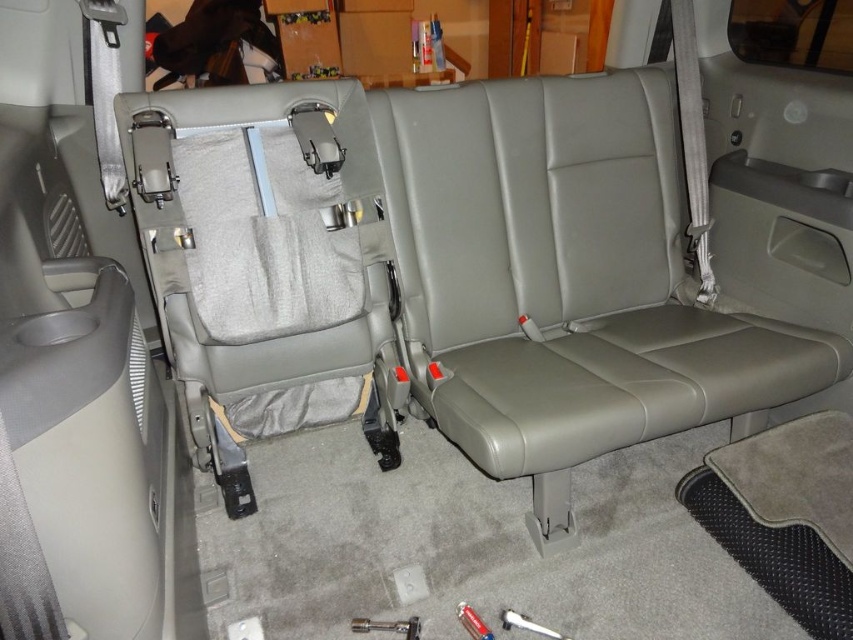
Is white plastic screwdriver at lower center thinner than metallic silver screwdriver at center?

No.

Who is positioned more to the left, white plastic screwdriver at lower center or metallic silver screwdriver at center?

From the viewer's perspective, metallic silver screwdriver at center appears more on the left side.

Between point (503, 612) and point (467, 625), which one is positioned behind?

Point (503, 612)

Find the location of a particular element. This screenshot has height=640, width=853. white plastic screwdriver at lower center is located at coordinates (527, 625).

Which is more to the right, metallic silver wrench at center or white plastic screwdriver at lower center?

white plastic screwdriver at lower center is more to the right.

Which is below, metallic silver wrench at center or white plastic screwdriver at lower center?

metallic silver wrench at center is lower down.

The width and height of the screenshot is (853, 640). I want to click on metallic silver wrench at center, so 387,627.

Who is lower down, metallic silver wrench at center or metallic silver screwdriver at center?

Positioned lower is metallic silver wrench at center.

Which of these two, metallic silver wrench at center or metallic silver screwdriver at center, stands shorter?

metallic silver wrench at center is shorter.

Between point (379, 628) and point (488, 637), which one is positioned in front?

Positioned in front is point (488, 637).

Where is `metallic silver wrench at center`? The width and height of the screenshot is (853, 640). metallic silver wrench at center is located at coordinates (387, 627).